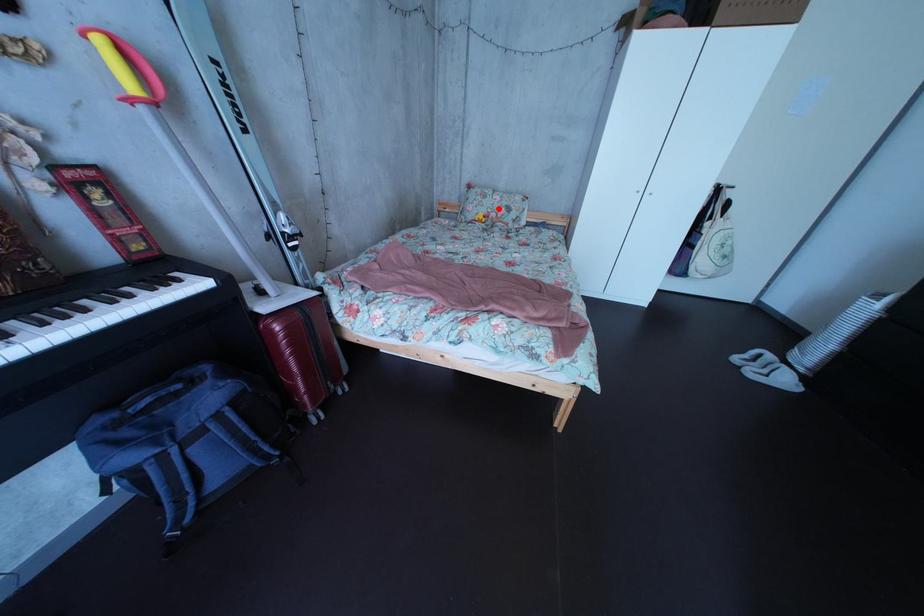
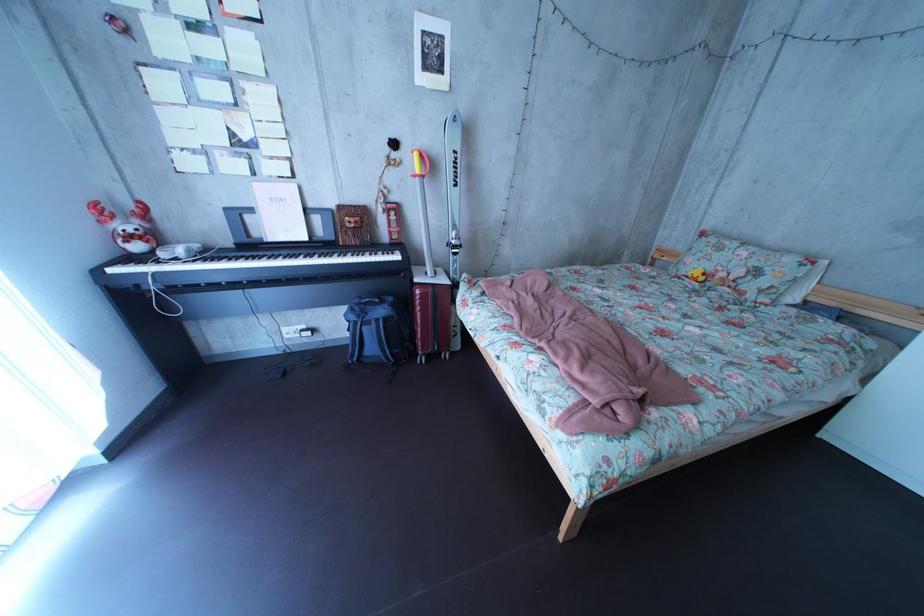
Where in the second image is the point corresponding to the highlighted location from the first image?

(731, 262)